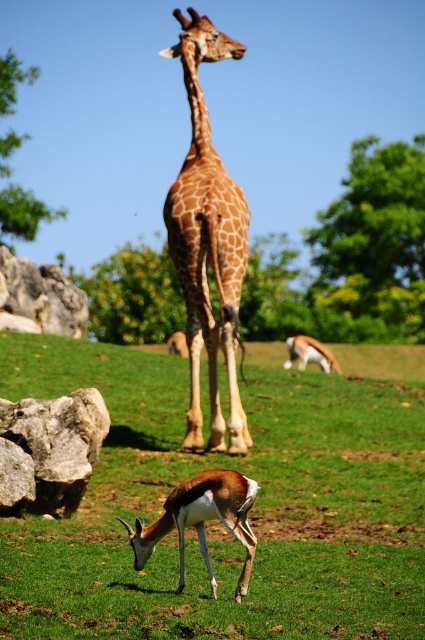
You are a gardener trying to plant a new flower in the green grass at center and the gray rough rock at lower left. Which location would be more suitable for planting the flower?

The green grass at center is larger in size than the gray rough rock at lower left, so planting the flower in the green grass at center would be more suitable as it provides more space and nutrients for growth.

In the scene shown: You are standing at the point labeled point (x=101, y=396) and want to walk to the point labeled point (x=325, y=577). Which direction should you face to move towards your destination?

You should face towards the direction of the point labeled point (x=325, y=577) because it is in front of point (x=101, y=396).